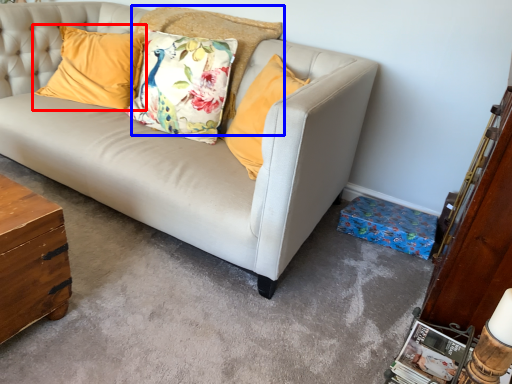
Question: Which of the following is the farthest to the observer, pillow (highlighted by a red box) or pillow (highlighted by a blue box)?

Choices:
 (A) pillow
 (B) pillow

Answer: (A)